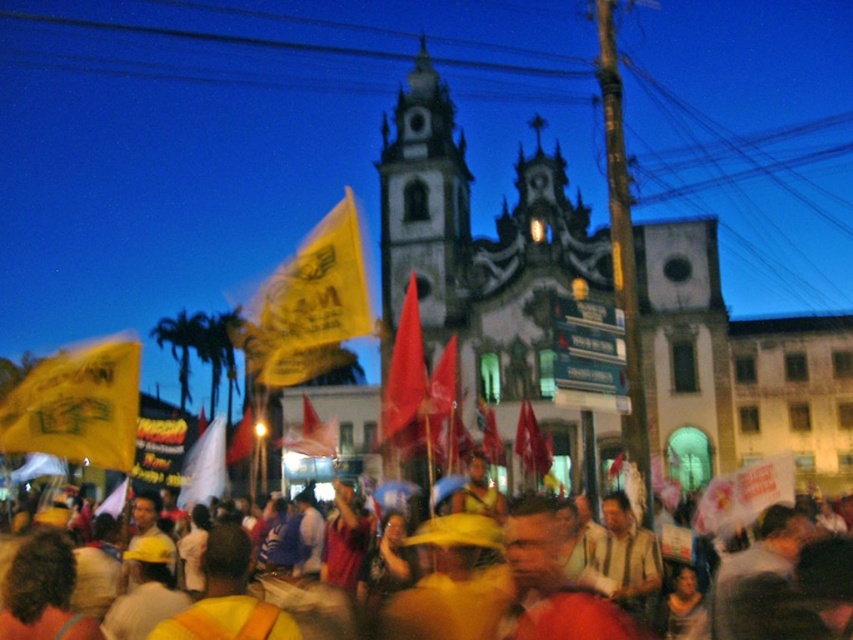
Does yellow paper flag at left appear over red fabric flag at center?

Indeed, yellow paper flag at left is positioned over red fabric flag at center.

The image size is (853, 640). What do you see at coordinates (77, 404) in the screenshot?
I see `yellow paper flag at left` at bounding box center [77, 404].

Find the location of a particular element. yellow paper flag at left is located at coordinates (77, 404).

Who is higher up, yellow paper flag at center or yellow hard hats at center?

Positioned higher is yellow paper flag at center.

From the picture: Is yellow paper flag at center positioned in front of yellow hard hats at center?

No.

Where is `yellow paper flag at center`? yellow paper flag at center is located at coordinates (309, 305).

This screenshot has width=853, height=640. Find the location of `yellow paper flag at center`. yellow paper flag at center is located at coordinates point(309,305).

Is matte red flag at center taller than yellow fabric flag at center?

Indeed, matte red flag at center has a greater height compared to yellow fabric flag at center.

Who is more distant from viewer, (392, 435) or (230, 452)?

Point (230, 452)

The image size is (853, 640). What are the coordinates of `matte red flag at center` in the screenshot? It's located at [405, 378].